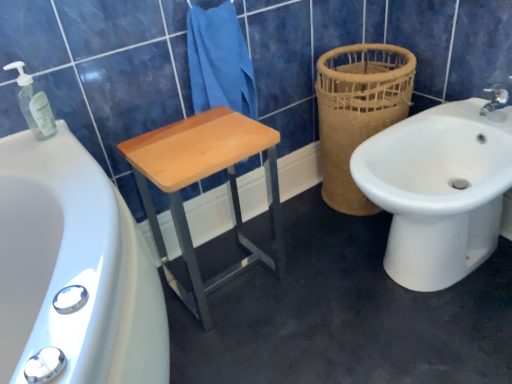
Question: Is white ceramic bidet at right positioned far away from brown woven basket at right?

Choices:
 (A) yes
 (B) no

Answer: (B)

Question: Is white ceramic bidet at right oriented towards brown woven basket at right?

Choices:
 (A) yes
 (B) no

Answer: (B)

Question: Is white ceramic bidet at right further to camera compared to brown woven basket at right?

Choices:
 (A) yes
 (B) no

Answer: (B)

Question: Is white ceramic bidet at right outside brown woven basket at right?

Choices:
 (A) yes
 (B) no

Answer: (A)

Question: Considering the relative positions of white ceramic bidet at right and brown woven basket at right in the image provided, is white ceramic bidet at right in front of brown woven basket at right?

Choices:
 (A) no
 (B) yes

Answer: (B)

Question: Is white ceramic bidet at right shorter than brown woven basket at right?

Choices:
 (A) no
 (B) yes

Answer: (B)

Question: From a real-world perspective, is light wood/matte stool at center on brown woven basket at right?

Choices:
 (A) yes
 (B) no

Answer: (B)

Question: Can you confirm if light wood/matte stool at center is positioned to the right of brown woven basket at right?

Choices:
 (A) no
 (B) yes

Answer: (A)

Question: Is light wood/matte stool at center turned away from brown woven basket at right?

Choices:
 (A) yes
 (B) no

Answer: (B)

Question: From a real-world perspective, does light wood/matte stool at center sit lower than brown woven basket at right?

Choices:
 (A) no
 (B) yes

Answer: (B)

Question: Does light wood/matte stool at center have a lesser width compared to brown woven basket at right?

Choices:
 (A) yes
 (B) no

Answer: (A)

Question: Would you say light wood/matte stool at center contains brown woven basket at right?

Choices:
 (A) no
 (B) yes

Answer: (A)

Question: Are white ceramic bidet at right and light wood/matte stool at center far apart?

Choices:
 (A) yes
 (B) no

Answer: (B)